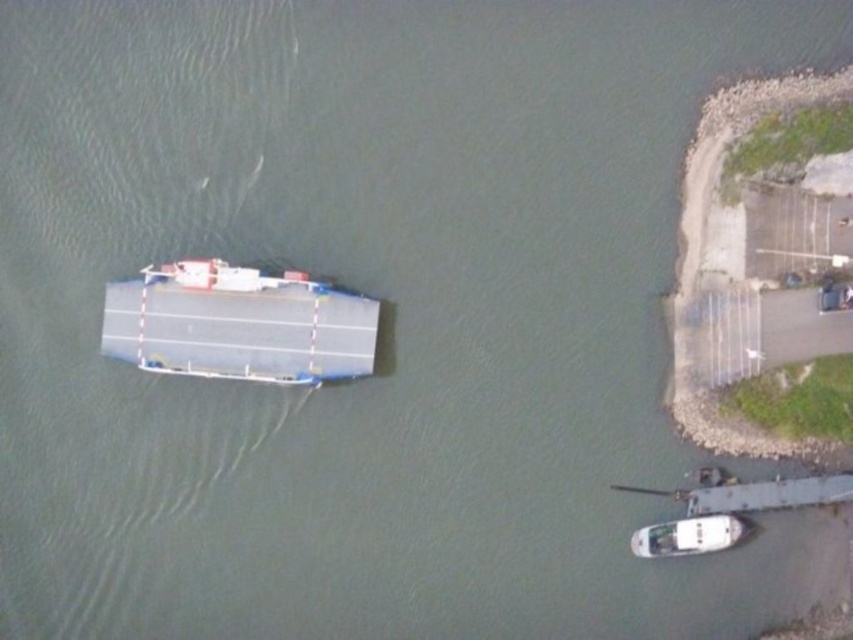
Question: Among these points, which one is farthest from the camera?

Choices:
 (A) (221, 262)
 (B) (720, 538)

Answer: (A)

Question: In this image, where is white glossy boat at center-left located relative to white glossy boat at lower right?

Choices:
 (A) left
 (B) right

Answer: (A)

Question: Can you confirm if white glossy boat at center-left is smaller than white glossy boat at lower right?

Choices:
 (A) no
 (B) yes

Answer: (A)

Question: Is white glossy boat at center-left to the right of white glossy boat at lower right from the viewer's perspective?

Choices:
 (A) no
 (B) yes

Answer: (A)